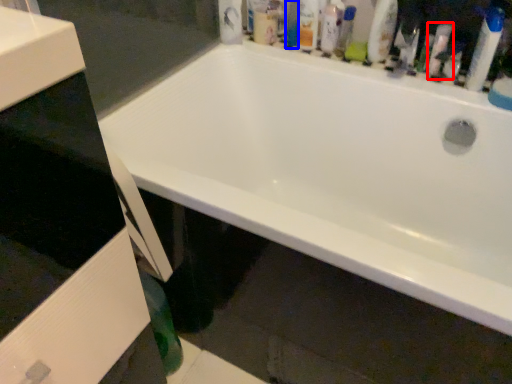
Question: Which point is closer to the camera, cleaning product (highlighted by a red box) or mouthwash (highlighted by a blue box)?

Choices:
 (A) cleaning product
 (B) mouthwash

Answer: (A)